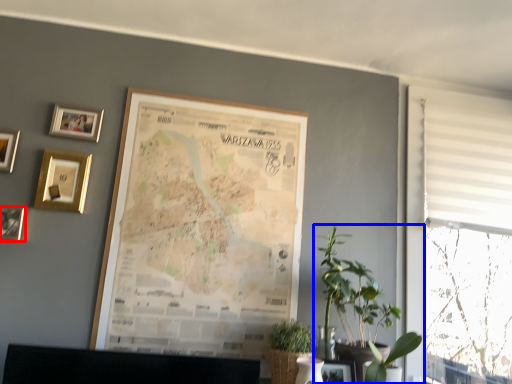
Question: Which object is further to the camera taking this photo, picture frame (highlighted by a red box) or houseplant (highlighted by a blue box)?

Choices:
 (A) picture frame
 (B) houseplant

Answer: (A)